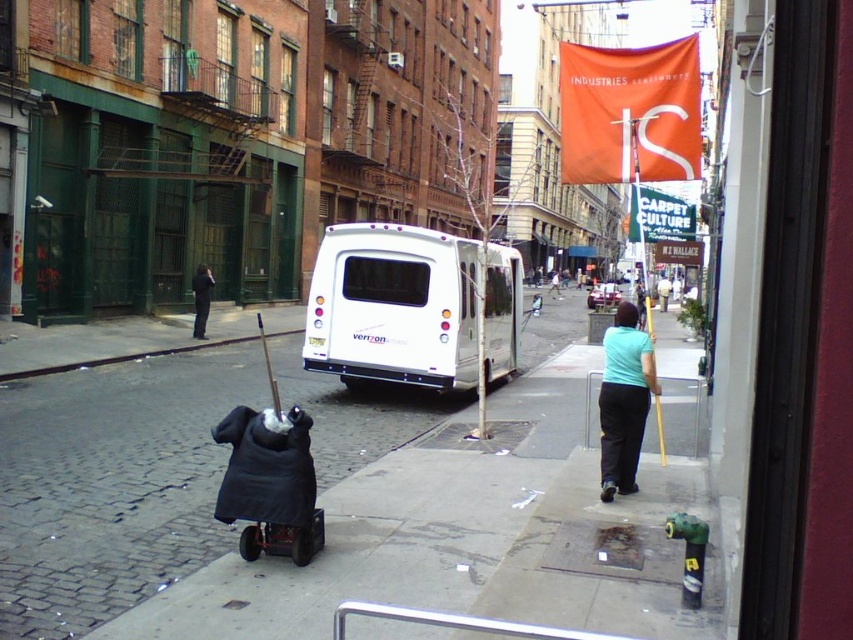
Which is more to the right, white glossy van at center or light blue t-shirt at center?

light blue t-shirt at center is more to the right.

Who is more forward, (434, 380) or (630, 333)?

Point (630, 333) is more forward.

Find the location of `white glossy van at center`. white glossy van at center is located at coordinates (393, 307).

Which is in front, point (653, 369) or point (200, 316)?

Point (653, 369)

Does light blue t-shirt at center have a smaller size compared to black fabric coat at center?

No.

I want to click on light blue t-shirt at center, so click(624, 401).

Locate an element on the screen. This screenshot has height=640, width=853. light blue t-shirt at center is located at coordinates (624, 401).

Can you confirm if black fabric baby carriage at lower left is taller than black fabric coat at center?

In fact, black fabric baby carriage at lower left may be shorter than black fabric coat at center.

Which is behind, point (236, 444) or point (196, 307)?

The point (196, 307) is more distant.

Is point (234, 465) in front of point (207, 272)?

Yes, it is.

In order to click on black fabric baby carriage at lower left in this screenshot , I will do `click(270, 483)`.